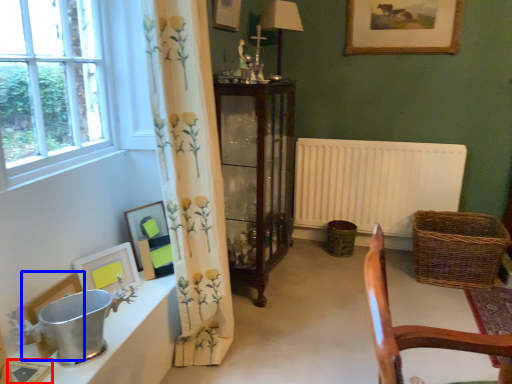
Question: Among these objects, which one is farthest to the camera, picture frame (highlighted by a red box) or picture frame (highlighted by a blue box)?

Choices:
 (A) picture frame
 (B) picture frame

Answer: (B)